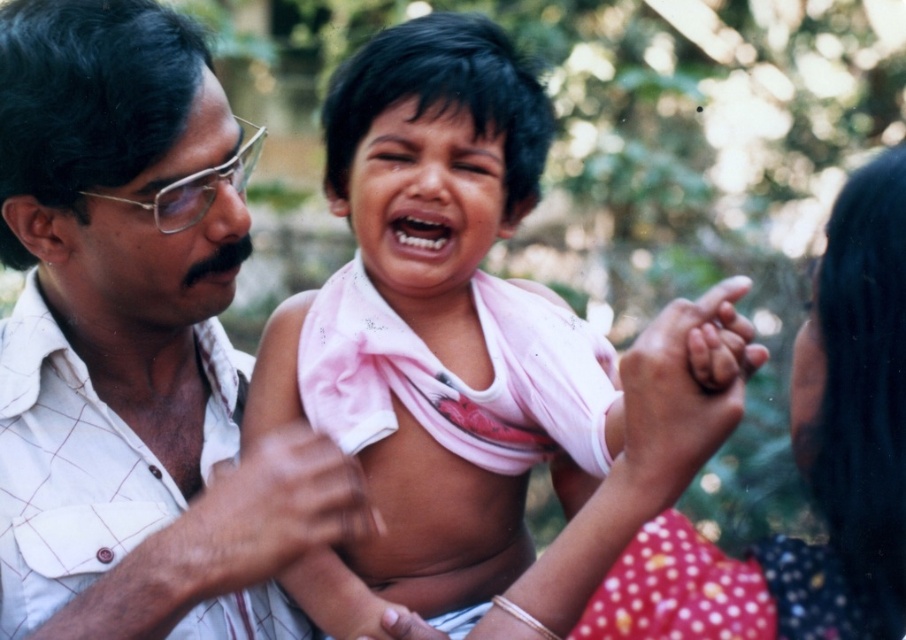
Can you confirm if pink fabric cloth at center is shorter than pink cotton shirt at center?

In fact, pink fabric cloth at center may be taller than pink cotton shirt at center.

Describe the element at coordinates (432, 330) in the screenshot. The height and width of the screenshot is (640, 906). I see `pink fabric cloth at center` at that location.

Find the location of `pink fabric cloth at center`. pink fabric cloth at center is located at coordinates (432, 330).

Does white checkered shirt at left have a lesser width compared to pink cotton shirt at center?

No.

Image resolution: width=906 pixels, height=640 pixels. Describe the element at coordinates (135, 346) in the screenshot. I see `white checkered shirt at left` at that location.

Where is `white checkered shirt at left`? white checkered shirt at left is located at coordinates (135, 346).

What do you see at coordinates (135, 346) in the screenshot? Image resolution: width=906 pixels, height=640 pixels. I see `white checkered shirt at left` at bounding box center [135, 346].

Can you confirm if white checkered shirt at left is positioned above pink fabric cloth at center?

Actually, white checkered shirt at left is below pink fabric cloth at center.

Does point (42, 470) lie in front of point (489, 353)?

Yes.

The image size is (906, 640). What are the coordinates of `white checkered shirt at left` in the screenshot? It's located at (135, 346).